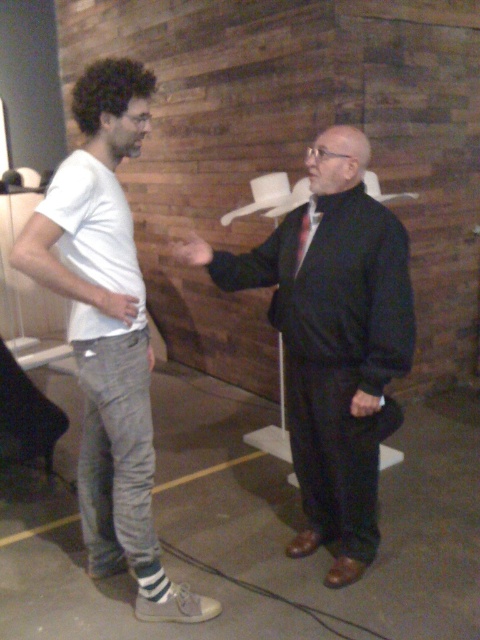
Question: Which point is closer to the camera?

Choices:
 (A) (310, 204)
 (B) (189, 262)

Answer: (A)

Question: Does white matte hand at center appear over matte black hand at center?

Choices:
 (A) yes
 (B) no

Answer: (B)

Question: Which object is closer to the camera taking this photo?

Choices:
 (A) white cotton t-shirt at left
 (B) white matte hand at center
 (C) smooth black hand at center

Answer: (A)

Question: Is matte black jacket at center thinner than dark red silk tie at center?

Choices:
 (A) no
 (B) yes

Answer: (A)

Question: Among these objects, which one is nearest to the camera?

Choices:
 (A) smooth black hand at center
 (B) white cotton t-shirt at left
 (C) dark red silk tie at center
 (D) matte black jacket at center

Answer: (B)

Question: Does white cotton t-shirt at left come behind dark red silk tie at center?

Choices:
 (A) no
 (B) yes

Answer: (A)